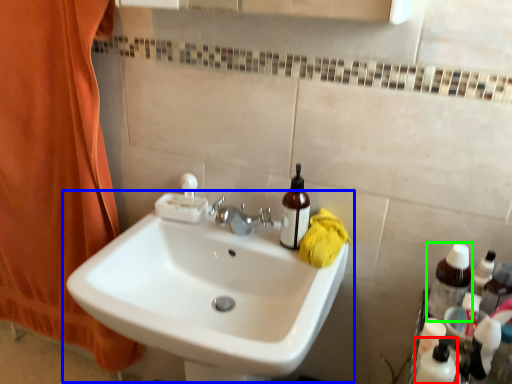
Question: Which is nearer to the toiletry (highlighted by a red box)? sink (highlighted by a blue box) or bottle (highlighted by a green box).

Choices:
 (A) sink
 (B) bottle

Answer: (B)